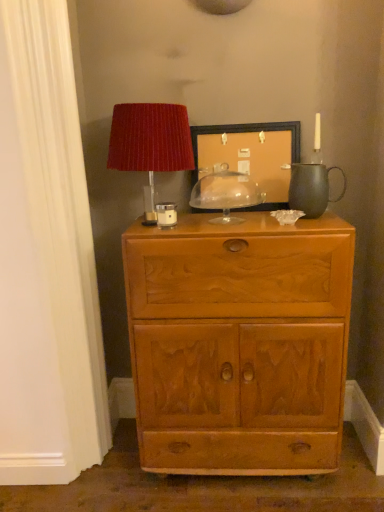
The image size is (384, 512). Identify the location of vacant space in front of matte white candle holder at upper center, placed as the 1th candle holder when sorted from left to right. (173, 228).